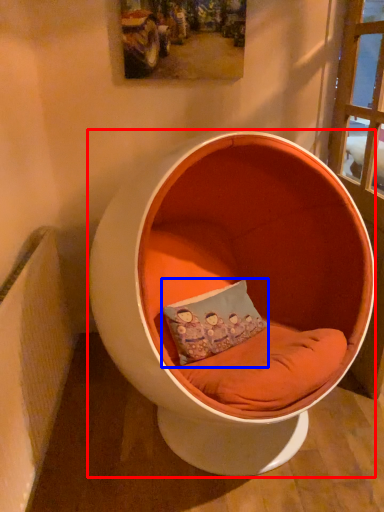
Question: Among these objects, which one is nearest to the camera, furniture (highlighted by a red box) or pillow (highlighted by a blue box)?

Choices:
 (A) furniture
 (B) pillow

Answer: (A)